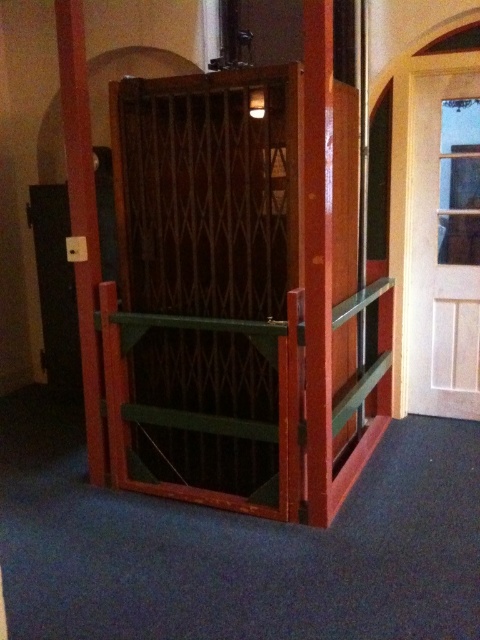
Which is below, metallic silver elevator at center or wooden pole at left?

Positioned lower is metallic silver elevator at center.

Where is `metallic silver elevator at center`? metallic silver elevator at center is located at coordinates coord(206,282).

You are a GUI agent. You are given a task and a screenshot of the screen. Output one action in this format:
    pyautogui.click(x=<x>, y=<y>)
    Task: Click on the metallic silver elevator at center
    This screenshot has width=480, height=640.
    Given the screenshot: What is the action you would take?
    pyautogui.click(x=206, y=282)

Is white wooden door at upper right below green wood balustrade at center?

No, white wooden door at upper right is not below green wood balustrade at center.

Does white wooden door at upper right appear on the right side of green wood balustrade at center?

Yes, white wooden door at upper right is to the right of green wood balustrade at center.

Which is behind, point (453, 132) or point (251, 330)?

Positioned behind is point (453, 132).

Locate an element on the screen. white wooden door at upper right is located at coordinates (443, 246).

Does metallic silver elevator at center appear over green wood balustrade at center?

Indeed, metallic silver elevator at center is positioned over green wood balustrade at center.

Between metallic silver elevator at center and green wood balustrade at center, which one is positioned higher?

Positioned higher is metallic silver elevator at center.

Is point (124, 340) behind point (173, 408)?

That is False.

This screenshot has width=480, height=640. I want to click on metallic silver elevator at center, so click(x=206, y=282).